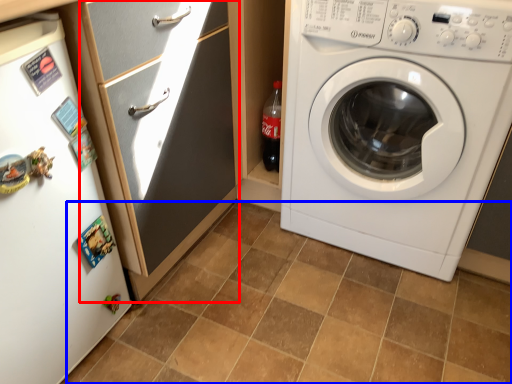
Question: Which object appears closest to the camera in this image, screen door (highlighted by a red box) or ceramic tile (highlighted by a blue box)?

Choices:
 (A) screen door
 (B) ceramic tile

Answer: (B)